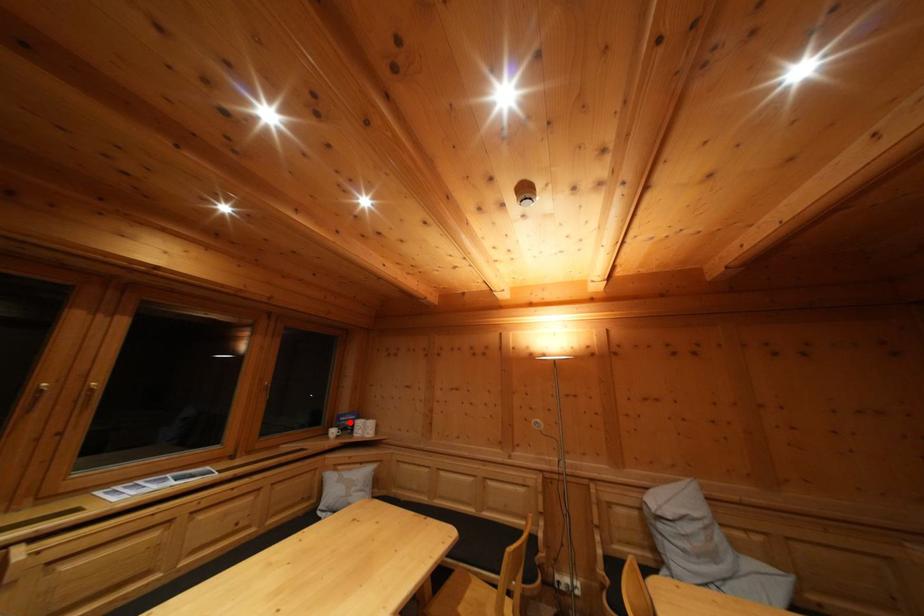
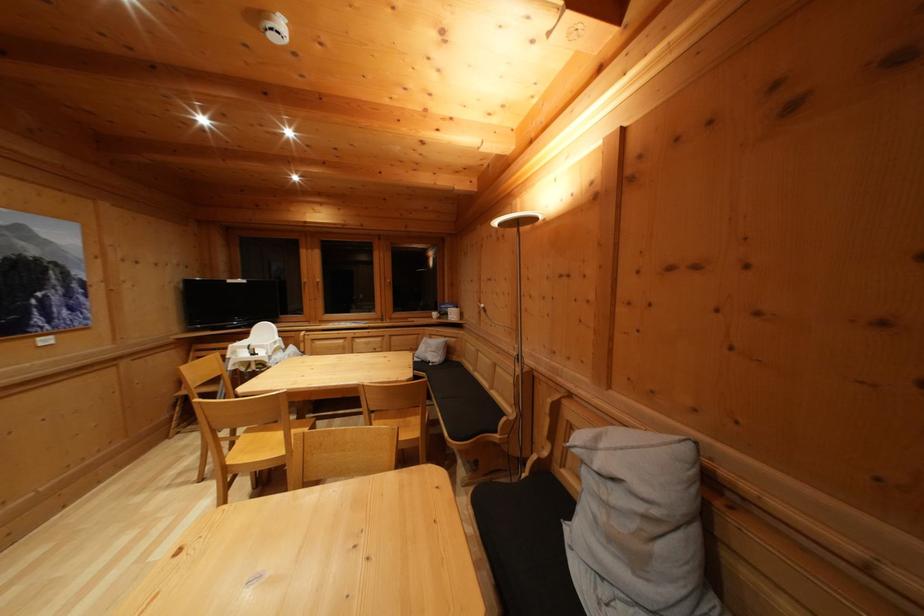
Find the pixel in the second image that matches the highlighted location in the first image.

(450, 310)